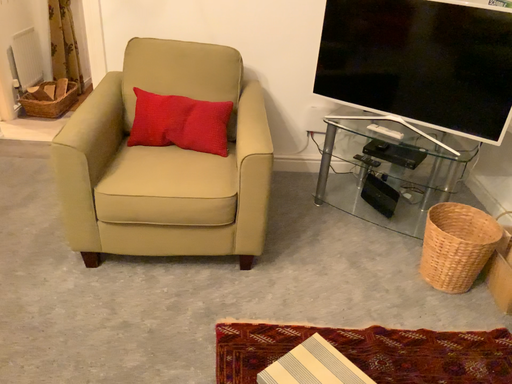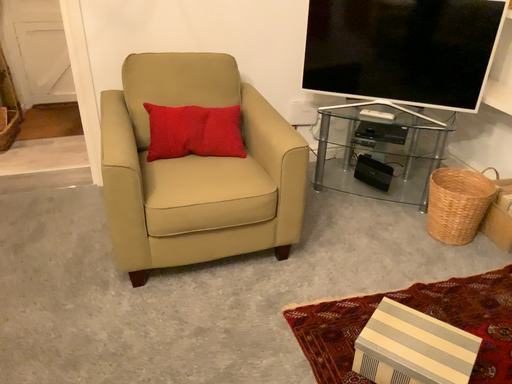
Question: Which way did the camera rotate in the video?

Choices:
 (A) rotated right
 (B) rotated left

Answer: (A)